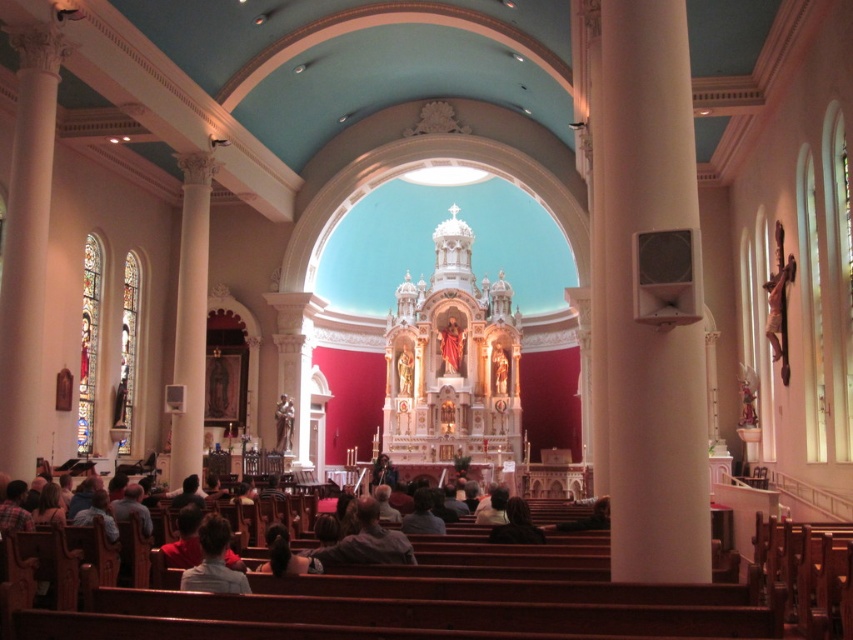
Question: Estimate the real-world distances between objects in this image. Which object is farther from the white glossy speaker at right?

Choices:
 (A) matte bronze statue at center
 (B) matte red statue at center
 (C) light brown wooden pew at lower center
 (D) gold statue at center

Answer: (D)

Question: Based on their relative distances, which object is nearer to the dark gray sweater at lower center?

Choices:
 (A) light brown wooden pew at lower center
 (B) gray fabric jacket at center

Answer: (A)

Question: Which of the following is the closest to the observer?

Choices:
 (A) (525, 522)
 (B) (366, 529)
 (C) (454, 355)
 (D) (289, 396)

Answer: (B)

Question: Is gray fabric jacket at center above matte bronze statue at center?

Choices:
 (A) no
 (B) yes

Answer: (B)

Question: Does light brown wooden pew at lower center have a lesser width compared to gold statue at center?

Choices:
 (A) no
 (B) yes

Answer: (A)

Question: Is white glossy speaker at right in front of matte bronze statue at center?

Choices:
 (A) yes
 (B) no

Answer: (A)